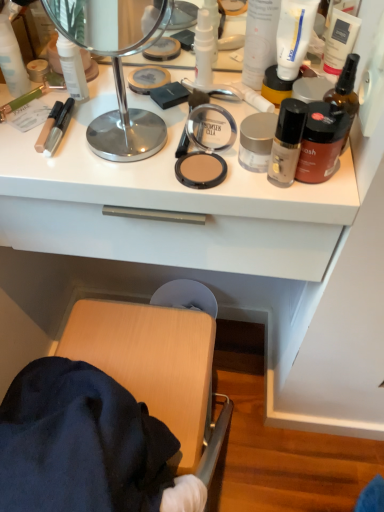
Image resolution: width=384 pixels, height=512 pixels. I want to click on vacant region to the right of matte white lotion at upper left, which is counted as the tenth toiletry, starting from the right, so click(x=111, y=98).